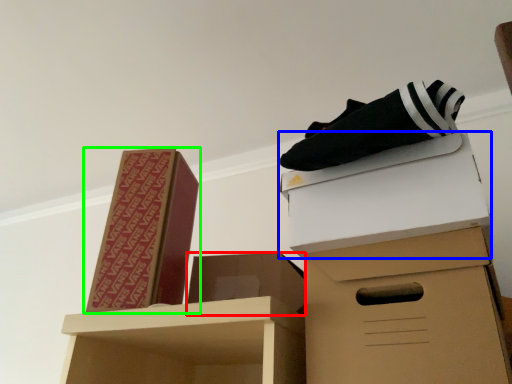
Question: Estimate the real-world distances between objects in this image. Which object is farther from box (highlighted by a red box), box (highlighted by a blue box) or box (highlighted by a green box)?

Choices:
 (A) box
 (B) box

Answer: (A)